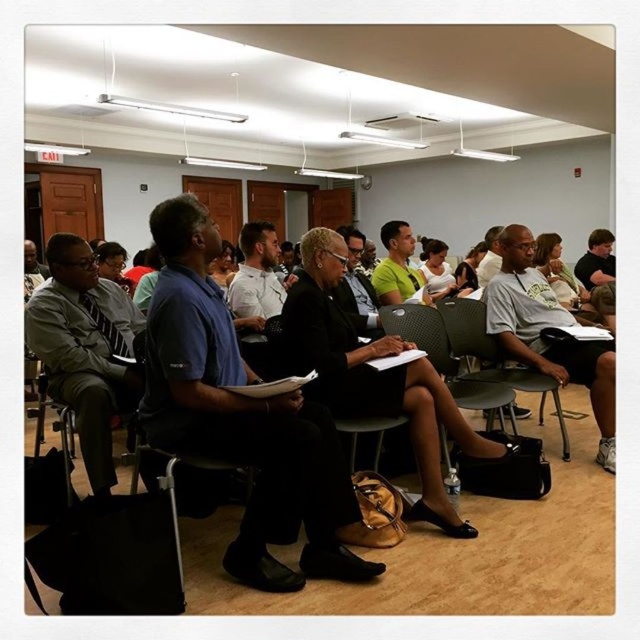
Does matte blue shirt at center have a larger size compared to matte black suit at center?

Yes.

Is matte blue shirt at center to the right of matte black suit at center from the viewer's perspective?

Indeed, matte blue shirt at center is positioned on the right side of matte black suit at center.

Between point (436, 508) and point (342, 289), which one is positioned in front?

Point (436, 508) is in front.

The height and width of the screenshot is (640, 640). I want to click on matte blue shirt at center, so click(x=376, y=376).

Who is more forward, (540, 380) or (257, 225)?

Point (540, 380) is in front.

In the scene shown: Between gray plastic chair at center and white cotton shirt at center, which one appears on the right side from the viewer's perspective?

gray plastic chair at center is more to the right.

Measure the distance between point [522,369] and camera.

Point [522,369] and camera are 3.49 meters apart from each other.

Locate an element on the screen. gray plastic chair at center is located at coordinates (492, 356).

Consider the image. Between green cotton t-shirt at center and matte black suit at center, which one has more height?

green cotton t-shirt at center

Can you confirm if green cotton t-shirt at center is taller than matte black suit at center?

Yes.

Is point (544, 342) closer to viewer compared to point (355, 321)?

No, (544, 342) is further to viewer.

Find the location of a particular element. This screenshot has width=640, height=640. green cotton t-shirt at center is located at coordinates (548, 328).